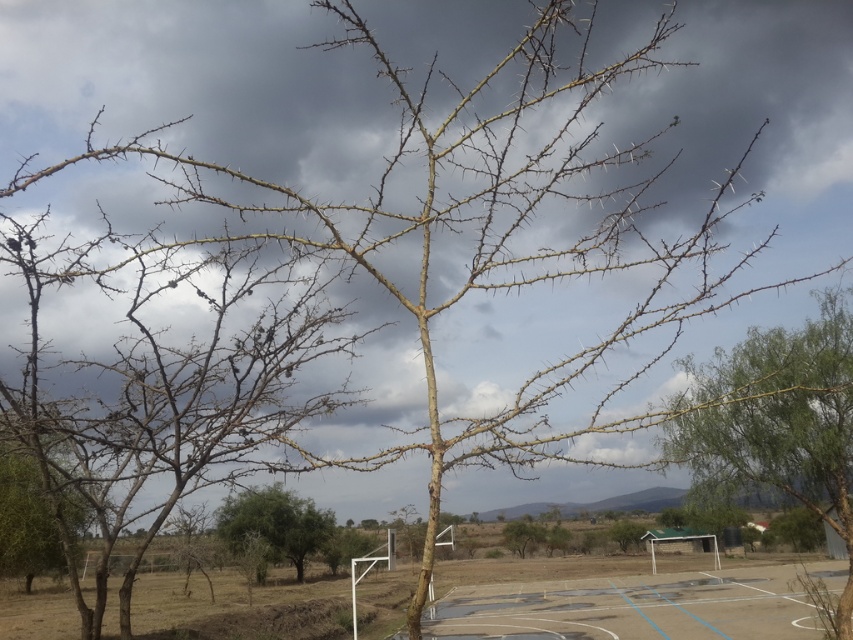
Question: Can you confirm if blue painted concrete basketball court at lower center is positioned to the right of brown thorny tree at lower left?

Choices:
 (A) no
 (B) yes

Answer: (B)

Question: Among these objects, which one is nearest to the camera?

Choices:
 (A) brown thorny tree at lower left
 (B) blue painted concrete basketball court at lower center

Answer: (A)

Question: Does blue painted concrete basketball court at lower center appear over brown thorny tree at lower left?

Choices:
 (A) no
 (B) yes

Answer: (A)

Question: Is brown thorny branches at center further to the viewer compared to brown thorny tree at lower left?

Choices:
 (A) no
 (B) yes

Answer: (A)

Question: Which point is farther to the camera?

Choices:
 (A) (744, 376)
 (B) (28, 518)
 (C) (291, 545)

Answer: (C)

Question: Among these points, which one is farthest from the camera?

Choices:
 (A) (799, 356)
 (B) (799, 636)
 (C) (3, 515)
 (D) (294, 499)

Answer: (D)